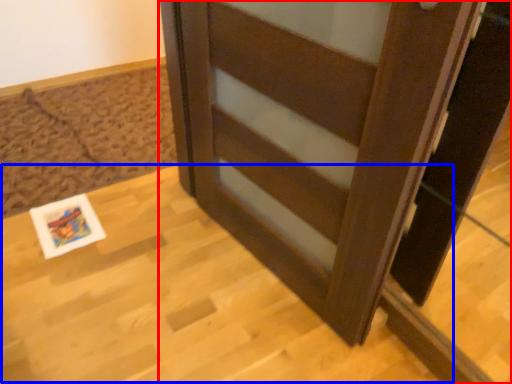
Question: Which point is further to the camera, furniture (highlighted by a red box) or table (highlighted by a blue box)?

Choices:
 (A) furniture
 (B) table

Answer: (B)